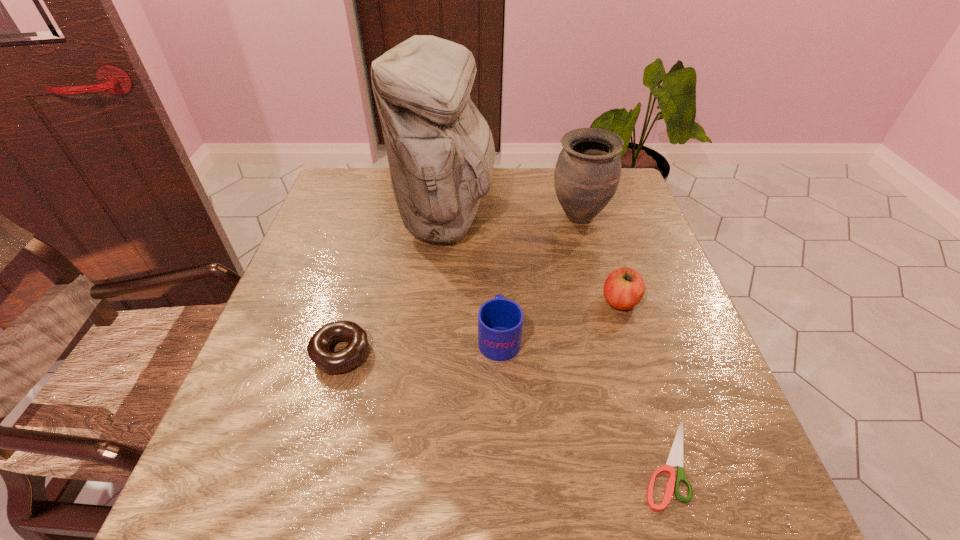
At what (x,y) coordinates should I click in order to perform the action: click on free space between the mug and the backpack. Please return your answer as a coordinate pair (x, y). Looking at the image, I should click on (472, 278).

Locate an element on the screen. This screenshot has height=540, width=960. free space between the urn and the backpack is located at coordinates (513, 218).

Where is `free space between the mug and the doughnut`? The width and height of the screenshot is (960, 540). free space between the mug and the doughnut is located at coordinates pos(420,345).

Locate an element on the screen. This screenshot has height=540, width=960. vacant space that is in between the mug and the backpack is located at coordinates (472, 278).

In order to click on unoccupied area between the scissors and the tallest object in this screenshot , I will do `click(557, 341)`.

You are a GUI agent. You are given a task and a screenshot of the screen. Output one action in this format:
    pyautogui.click(x=<x>, y=<y>)
    Task: Click on the unoccupied area between the second shortest object and the urn
    
    Given the screenshot: What is the action you would take?
    pyautogui.click(x=460, y=286)

You are a GUI agent. You are given a task and a screenshot of the screen. Output one action in this format:
    pyautogui.click(x=<x>, y=<y>)
    Task: Click on the vacant space in between the tallest object and the mug
    The width and height of the screenshot is (960, 540).
    Given the screenshot: What is the action you would take?
    (x=472, y=278)

Find the location of a particular element. free space between the mug and the apple is located at coordinates (560, 319).

Image resolution: width=960 pixels, height=540 pixels. What are the coordinates of `vacant area that lies between the mug and the apple` in the screenshot? It's located at click(x=560, y=319).

Choose which object is the third nearest neighbor to the scissors. Please provide its 2D coordinates. Your answer should be formatted as a tuple, i.e. [(x, y)], where the tuple contains the x and y coordinates of a point satisfying the conditions above.

[(440, 149)]